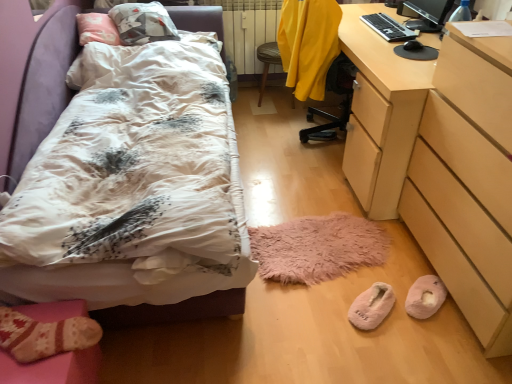
Locate an element on the screen. The image size is (512, 384). vacant space to the left of black plastic keyboard at upper right is located at coordinates (356, 23).